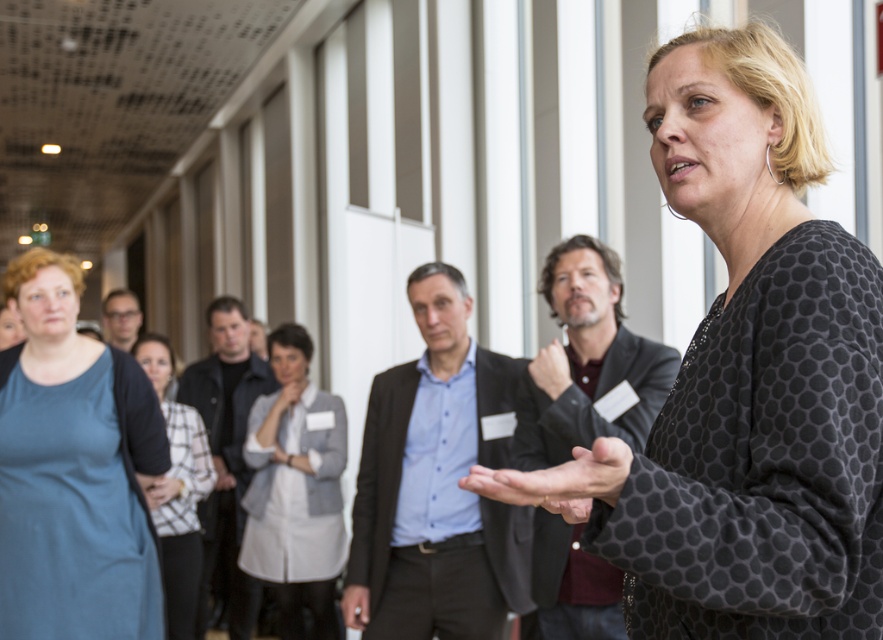
Is polka dot fabric at center shorter than white textured blouse at center?

Yes.

Which of these two, polka dot fabric at center or white textured blouse at center, stands taller?

white textured blouse at center

I want to click on polka dot fabric at center, so click(745, 380).

Is polka dot fabric at center below light gray fabric jacket at center?

Incorrect, polka dot fabric at center is not positioned below light gray fabric jacket at center.

Is point (736, 493) behind point (331, 536)?

No, it is in front of (331, 536).

Is point (854, 388) positioned after point (323, 544)?

No.

What are the coordinates of `polka dot fabric at center` in the screenshot? It's located at (745, 380).

Between matte blue shirt at left and white textured blouse at center, which one has more height?

Standing taller between the two is white textured blouse at center.

Does matte blue shirt at left appear on the left side of white textured blouse at center?

Incorrect, matte blue shirt at left is not on the left side of white textured blouse at center.

Locate an element on the screen. This screenshot has height=640, width=883. matte blue shirt at left is located at coordinates (73, 470).